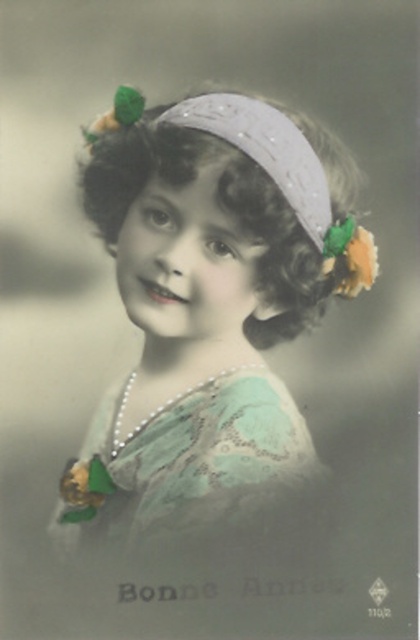
Question: Which object is closer to the camera taking this photo?

Choices:
 (A) white sequined headband at center
 (B) lace fabric dress at center
 (C) curly brown hair at center

Answer: (C)

Question: From the image, what is the correct spatial relationship of matte green dress at center in relation to green shiny flower at upper right?

Choices:
 (A) right
 (B) left

Answer: (B)

Question: Can you confirm if lace fabric dress at center is positioned above green shiny flower at upper right?

Choices:
 (A) no
 (B) yes

Answer: (A)

Question: Which object is the closest to the white sequined headband at center?

Choices:
 (A) matte green dress at center
 (B) curly brown hair at center

Answer: (B)

Question: Can you confirm if curly brown hair at center is smaller than green shiny flower at upper right?

Choices:
 (A) yes
 (B) no

Answer: (B)

Question: Which point appears closest to the camera in this image?

Choices:
 (A) pyautogui.click(x=273, y=168)
 (B) pyautogui.click(x=375, y=269)

Answer: (A)